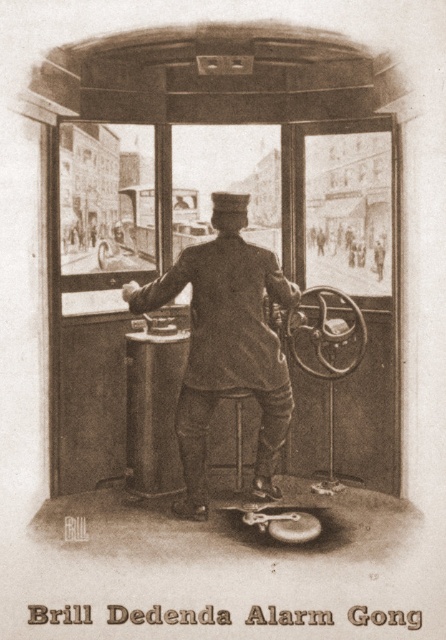
You are a passenger in the tram and want to ask the uniformed man at center for directions. Where should you look to find him?

The uniformed man at center is located at the coordinates point (226, 344), so you should look towards the center of the tram near those coordinates to find him.

You are a passenger in the tram and want to take a photo of the two points marked in the scene. Which point, point (269,291) or point (235,451), will appear larger in your photo?

Point (269,291) is closer to the camera than point (235,451), so it will appear larger in the photo.